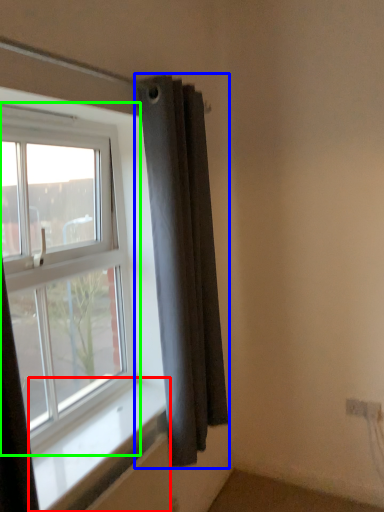
Question: Which object is the farthest from window sill (highlighted by a red box)? Choose among these: curtain (highlighted by a blue box) or window (highlighted by a green box).

Choices:
 (A) curtain
 (B) window

Answer: (A)